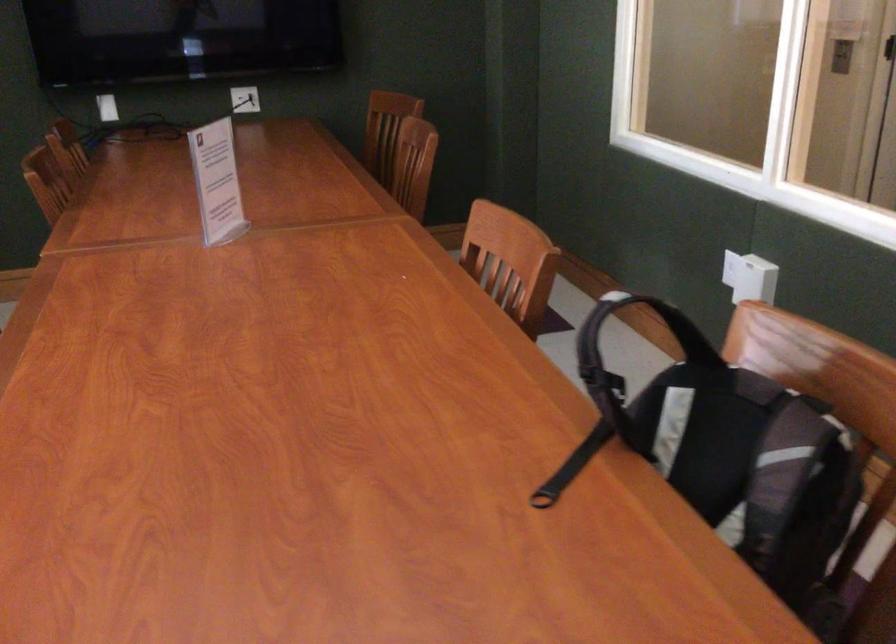
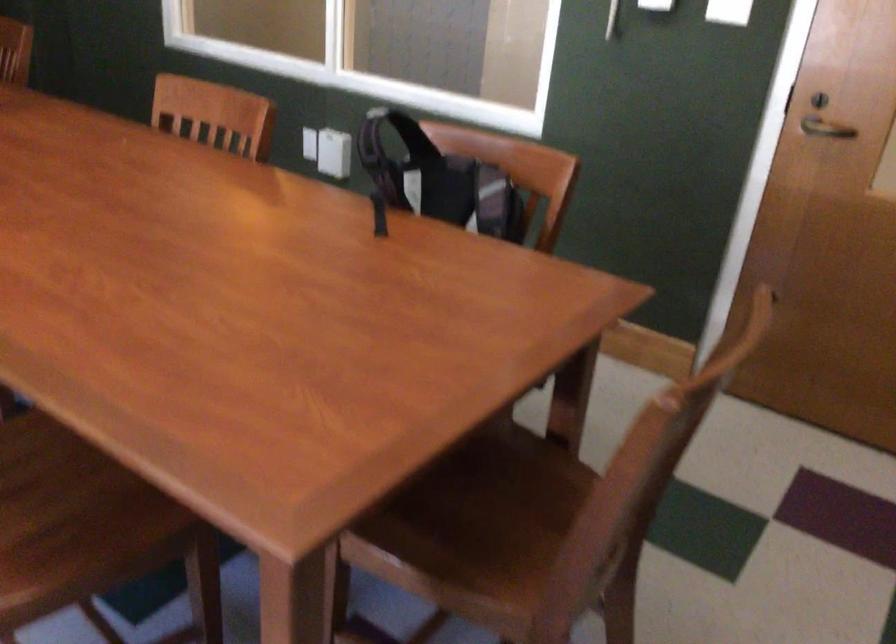
Locate, in the second image, the point that corresponds to pixel 719 408 in the first image.

(438, 180)